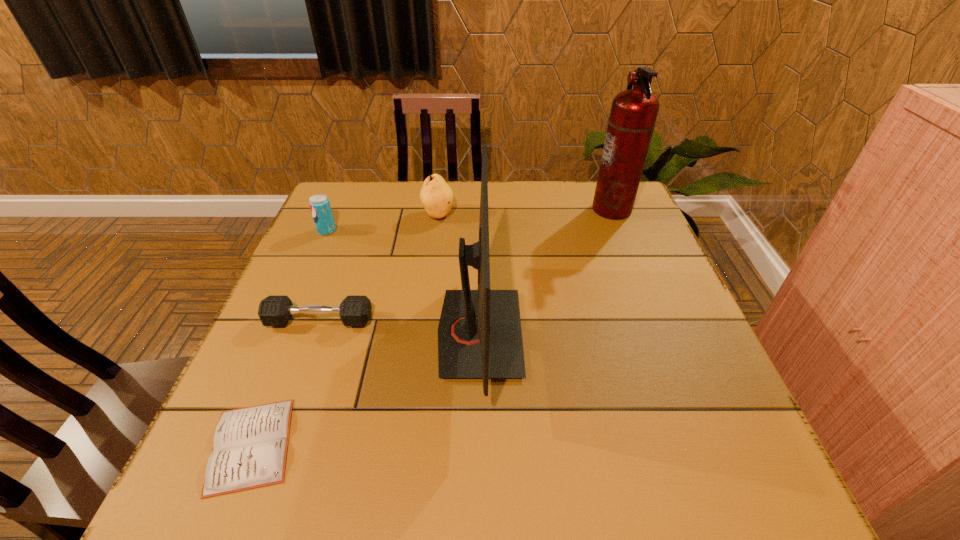
Image resolution: width=960 pixels, height=540 pixels. Identify the location of vacant space positioned on the nozzle side of the fire extinguisher. (532, 209).

You are a GUI agent. You are given a task and a screenshot of the screen. Output one action in this format:
    pyautogui.click(x=<x>, y=<y>)
    Task: Click on the vacant region located 0.260m on the screen side of the fifth shortest object
    This screenshot has width=960, height=540.
    Given the screenshot: What is the action you would take?
    pyautogui.click(x=639, y=333)

In order to click on vacant space located 0.060m on the right of the fourth shortest object in this screenshot , I will do `click(474, 215)`.

Locate an element on the screen. This screenshot has height=540, width=960. free space located 0.150m on the right of the soda can is located at coordinates (389, 231).

Find the location of a particular element. Image resolution: width=960 pixels, height=540 pixels. free space located 0.350m on the right of the dumbbell is located at coordinates (526, 321).

I want to click on vacant space positioned 0.100m on the back of the shortest object, so click(x=287, y=358).

This screenshot has height=540, width=960. I want to click on fire extinguisher present at the far edge, so click(x=633, y=114).

The width and height of the screenshot is (960, 540). In order to click on pear located at the far edge in this screenshot , I will do `click(436, 195)`.

Where is `object that is at the near edge`? This screenshot has width=960, height=540. object that is at the near edge is located at coordinates (250, 446).

The width and height of the screenshot is (960, 540). Find the location of `soda can located at the left edge`. soda can located at the left edge is located at coordinates click(319, 204).